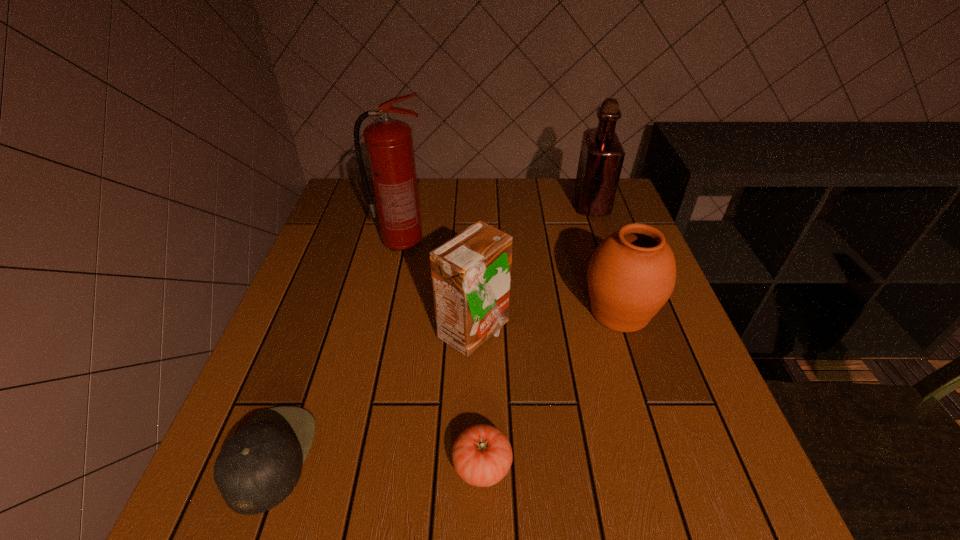
Identify the location of free space located 0.340m on the left of the farthest object. The width and height of the screenshot is (960, 540). (460, 205).

Find the location of a particular element. Image resolution: width=960 pixels, height=540 pixels. vacant area located 0.340m on the straw side of the carton is located at coordinates (669, 332).

This screenshot has width=960, height=540. In order to click on vacant position located on the left of the urn in this screenshot , I will do 464,312.

Locate an element on the screen. vacant area situated 0.080m on the brim of the fifth tallest object is located at coordinates (356, 457).

This screenshot has width=960, height=540. Find the location of `free space located on the left of the shortest object`. free space located on the left of the shortest object is located at coordinates (410, 465).

This screenshot has width=960, height=540. Identify the location of object that is positioned at the far edge. click(601, 158).

Image resolution: width=960 pixels, height=540 pixels. In order to click on cap that is positioned at the near edge in this screenshot , I will do `click(256, 469)`.

Find the location of a particular element. Image resolution: width=960 pixels, height=540 pixels. tomato located at the near edge is located at coordinates (482, 455).

The width and height of the screenshot is (960, 540). I want to click on fire extinguisher present at the left edge, so click(389, 146).

Identify the location of cap situated at the left edge. Image resolution: width=960 pixels, height=540 pixels. (256, 469).